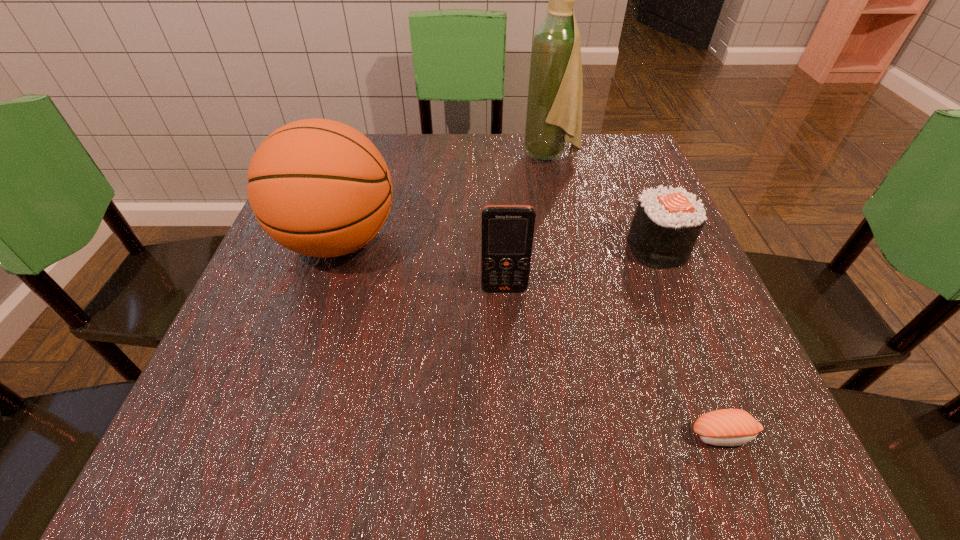
What are the coordinates of `wine bottle that is at the right edge` in the screenshot? It's located at (555, 91).

At what (x,y) coordinates should I click in order to perform the action: click on object that is at the far right corner. Please return your answer as a coordinate pair (x, y). Image resolution: width=960 pixels, height=540 pixels. Looking at the image, I should click on (555, 91).

Identify the location of object present at the near right corner. (726, 427).

Where is `free location at the far edge`? free location at the far edge is located at coordinates (481, 141).

Locate an element on the screen. The width and height of the screenshot is (960, 540). free point at the near edge is located at coordinates (528, 450).

Where is `free space at the left edge of the desktop`? This screenshot has height=540, width=960. free space at the left edge of the desktop is located at coordinates (298, 403).

Where is `free spot at the right edge of the desktop`? free spot at the right edge of the desktop is located at coordinates (608, 196).

I want to click on vacant space at the far right corner of the desktop, so click(605, 151).

You are a GUI agent. You are given a task and a screenshot of the screen. Output one action in this format:
    pyautogui.click(x=<x>, y=<y>)
    Task: Click on the free space between the shortest object and the cellular telephone
    
    Given the screenshot: What is the action you would take?
    614,362

The width and height of the screenshot is (960, 540). In order to click on vacant space that's between the farther sushi and the cellular telephone in this screenshot , I will do click(581, 268).